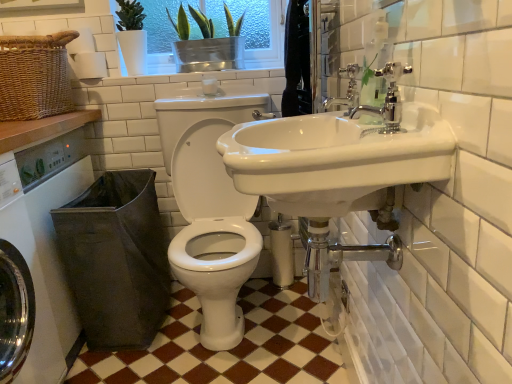
In order to face dark brown fabric laundry basket at lower left, should I rotate leftwards or rightwards?

To align with it, rotate left about 16.908°.

Find the location of a particular element. The image size is (512, 384). white tile at upper center is located at coordinates (193, 78).

This screenshot has height=384, width=512. Describe the element at coordinates (210, 210) in the screenshot. I see `white glossy toilet at center` at that location.

Measure the distance between point (x=324, y=104) and camera.

Point (x=324, y=104) is 5.07 feet from camera.

Describe the element at coordinates (388, 98) in the screenshot. The width and height of the screenshot is (512, 384). I see `polished chrome faucet at upper right, which is the second tap in back-to-front order` at that location.

This screenshot has height=384, width=512. I want to click on dark brown fabric laundry basket at lower left, so click(116, 259).

Is white matte toilet paper at upper left in contact with polished chrome faucet at upper right, the first tap when ordered from front to back?

No, white matte toilet paper at upper left is not next to polished chrome faucet at upper right, the first tap when ordered from front to back.

From a real-world perspective, who is located higher, white matte toilet paper at upper left or polished chrome faucet at upper right, which is the second tap in back-to-front order?

From a 3D spatial view, white matte toilet paper at upper left is above.

In terms of height, does white matte toilet paper at upper left look taller or shorter compared to polished chrome faucet at upper right, the first tap when ordered from front to back?

Clearly, white matte toilet paper at upper left is taller compared to polished chrome faucet at upper right, the first tap when ordered from front to back.

Consider the image. How far apart are white matte toilet paper at upper left and polished chrome faucet at upper right, which is the second tap in back-to-front order?

white matte toilet paper at upper left and polished chrome faucet at upper right, which is the second tap in back-to-front order, are 4.82 feet apart.

From a real-world perspective, is polished chrome faucet at upper right, the first tap when ordered from front to back, beneath white glossy toilet at center?

Actually, polished chrome faucet at upper right, the first tap when ordered from front to back, is physically above white glossy toilet at center in the real world.

Can you tell me how much polished chrome faucet at upper right, which is the second tap in back-to-front order, and white glossy toilet at center differ in facing direction?

The angle between the facing direction of polished chrome faucet at upper right, which is the second tap in back-to-front order, and the facing direction of white glossy toilet at center is 90.4 degrees.

Between polished chrome faucet at upper right, which is the second tap in back-to-front order, and white glossy toilet at center, which one appears on the right side from the viewer's perspective?

polished chrome faucet at upper right, which is the second tap in back-to-front order.

Between polished chrome faucet at upper right, the first tap when ordered from front to back, and white glossy toilet at center, which one has larger width?

white glossy toilet at center.

Between white glossy washing machine at left and chrome metallic faucet at upper right, the 1th tap when ordered from back to front, which one has smaller width?

chrome metallic faucet at upper right, the 1th tap when ordered from back to front.

Consider the image. Considering the relative positions of white glossy washing machine at left and chrome metallic faucet at upper right, marked as the 2th tap in a front-to-back arrangement, in the image provided, is white glossy washing machine at left behind chrome metallic faucet at upper right, marked as the 2th tap in a front-to-back arrangement,?

Yes, white glossy washing machine at left is further from the camera.

Are white glossy washing machine at left and chrome metallic faucet at upper right, the 1th tap when ordered from back to front, far apart?

Yes, white glossy washing machine at left and chrome metallic faucet at upper right, the 1th tap when ordered from back to front, are quite far apart.

Which is more to the right, white glossy washing machine at left or chrome metallic faucet at upper right, the 1th tap when ordered from back to front?

chrome metallic faucet at upper right, the 1th tap when ordered from back to front, is more to the right.

From the image's perspective, which is below, white matte toilet paper at upper left or white glossy toilet at center?

From the image's view, white glossy toilet at center is below.

Are white matte toilet paper at upper left and white glossy toilet at center beside each other?

There is a gap between white matte toilet paper at upper left and white glossy toilet at center.

Does white matte toilet paper at upper left have a lesser width compared to white glossy toilet at center?

Indeed, white matte toilet paper at upper left has a lesser width compared to white glossy toilet at center.

From a real-world perspective, is white matte toilet paper at upper left positioned under white glossy toilet at center based on gravity?

No, from a real-world perspective, white matte toilet paper at upper left is not beneath white glossy toilet at center.

Which is in front, white glossy toilet at center or white tile at upper center?

Positioned in front is white glossy toilet at center.

From a real-world perspective, which object stands above the other?

white tile at upper center.

Can you confirm if white glossy toilet at center is bigger than white tile at upper center?

Yes, white glossy toilet at center is bigger than white tile at upper center.

Is white glossy toilet at center located outside white tile at upper center?

white glossy toilet at center is positioned outside white tile at upper center.

From the image's perspective, is green glass window screen at upper center beneath white matte toilet paper at upper left?

Actually, green glass window screen at upper center appears above white matte toilet paper at upper left in the image.

Is green glass window screen at upper center aimed at white matte toilet paper at upper left?

No, green glass window screen at upper center does not turn towards white matte toilet paper at upper left.

Does point (277, 51) lie in front of point (103, 61)?

That is False.

Is dark brown fabric laundry basket at lower left positioned beyond the bounds of brown/white checkered floor at center?

dark brown fabric laundry basket at lower left lies outside brown/white checkered floor at center's area.

Can you confirm if dark brown fabric laundry basket at lower left is smaller than brown/white checkered floor at center?

Actually, dark brown fabric laundry basket at lower left might be larger than brown/white checkered floor at center.

From the image's perspective, between dark brown fabric laundry basket at lower left and brown/white checkered floor at center, who is located below?

brown/white checkered floor at center, from the image's perspective.

Where is `toilet paper to the left of polished chrome faucet at upper right, which is the second tap in back-to-front order`? Image resolution: width=512 pixels, height=384 pixels. toilet paper to the left of polished chrome faucet at upper right, which is the second tap in back-to-front order is located at coordinates (89, 65).

In the image, there is a polished chrome faucet at upper right, which is the second tap in back-to-front order. Identify the location of toilet below it (from the image's perspective). (210, 210).

When comparing their distances from white glossy washing machine at left, does dark brown fabric laundry basket at lower left or brown/white checkered floor at center seem further?

brown/white checkered floor at center lies further to white glossy washing machine at left than the other object.

Based on their spatial positions, is woven brown basket at upper left or dark brown fabric laundry basket at lower left further from green glass window screen at upper center?

The object further to green glass window screen at upper center is dark brown fabric laundry basket at lower left.

Considering their positions, is chrome metallic faucet at upper right, marked as the 2th tap in a front-to-back arrangement, positioned closer to white glossy washing machine at left than white glossy toilet at center?

white glossy toilet at center.

Which object lies further to the anchor point white glossy toilet at center, white matte toilet paper at upper left or green glass window screen at upper center?

white matte toilet paper at upper left is further to white glossy toilet at center.

When comparing their distances from brown/white checkered floor at center, does polished chrome faucet at upper right, the first tap when ordered from front to back, or chrome metallic faucet at upper right, the 1th tap when ordered from back to front, seem closer?

Among the two, chrome metallic faucet at upper right, the 1th tap when ordered from back to front, is located nearer to brown/white checkered floor at center.

When comparing their distances from green glass window screen at upper center, does white glossy washing machine at left or white glossy sink at center seem further?

white glossy sink at center is positioned further to the anchor green glass window screen at upper center.

From the image, which object appears to be nearer to green glass window screen at upper center, white glossy sink at center or white matte toilet paper at upper left?

Among the two, white matte toilet paper at upper left is located nearer to green glass window screen at upper center.

Based on their spatial positions, is polished chrome faucet at upper right, the first tap when ordered from front to back, or white glossy toilet at center closer to green glass window screen at upper center?

white glossy toilet at center is closer to green glass window screen at upper center.

Where is `basket between white matte toilet paper at upper left and brown/white checkered floor at center in the vertical direction`? The width and height of the screenshot is (512, 384). basket between white matte toilet paper at upper left and brown/white checkered floor at center in the vertical direction is located at coordinates (35, 76).

Find the location of a particular element. sink between woven brown basket at upper left and chrome metallic faucet at upper right, the 1th tap when ordered from back to front, from left to right is located at coordinates (339, 158).

Where is `toilet located between white glossy sink at center and dark brown fabric laundry basket at lower left in the depth direction`? The height and width of the screenshot is (384, 512). toilet located between white glossy sink at center and dark brown fabric laundry basket at lower left in the depth direction is located at coordinates (210, 210).

This screenshot has width=512, height=384. What are the coordinates of `laundry basket located between chrome metallic faucet at upper right, marked as the 2th tap in a front-to-back arrangement, and white matte toilet paper at upper left in the depth direction` in the screenshot? It's located at (116, 259).